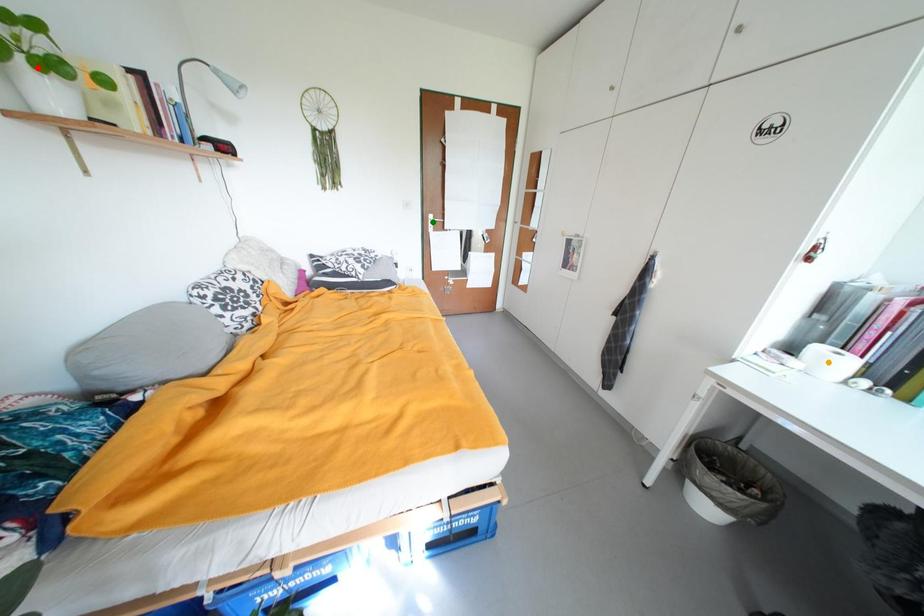
Order these from farthest to nearest:
red point | green point | orange point

1. green point
2. orange point
3. red point